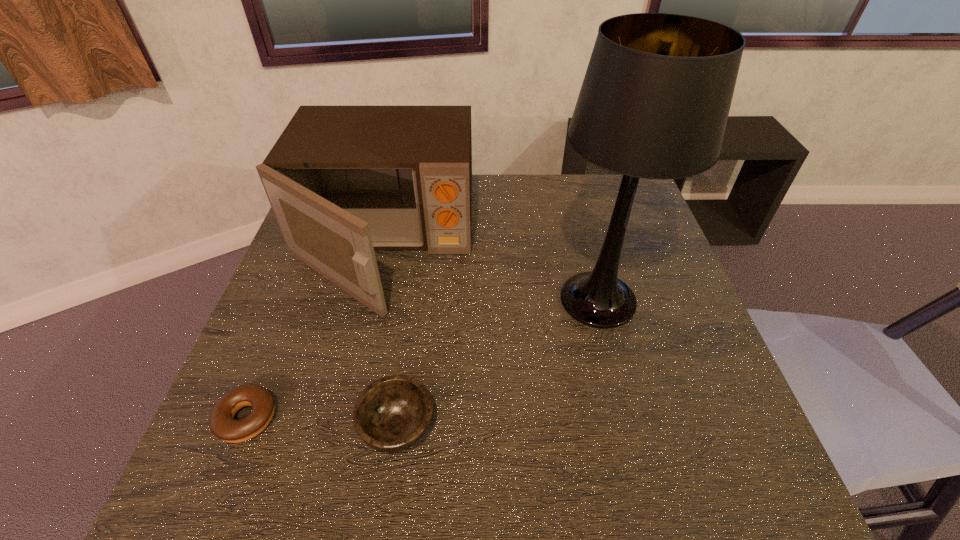
Image resolution: width=960 pixels, height=540 pixels. In order to click on vacant space that's between the table lamp and the second shortest object in this screenshot , I will do `click(497, 363)`.

At what (x,y) coordinates should I click in order to perform the action: click on free spot between the third shortest object and the doughnut. Please return your answer as a coordinate pair (x, y). The height and width of the screenshot is (540, 960). Looking at the image, I should click on (315, 332).

Identify the location of free area in between the table lamp and the doughnut. This screenshot has width=960, height=540. (422, 359).

Where is `free space between the bowl and the table lamp`? This screenshot has width=960, height=540. free space between the bowl and the table lamp is located at coordinates (497, 363).

Identify the location of free area in between the doughnut and the second shortest object. Image resolution: width=960 pixels, height=540 pixels. (323, 422).

The width and height of the screenshot is (960, 540). In order to click on vacant area that lies between the third tallest object and the rightmost object in this screenshot , I will do `click(497, 363)`.

At what (x,y) coordinates should I click in order to perform the action: click on vacant point located between the bowl and the shortest object. Please return your answer as a coordinate pair (x, y). Looking at the image, I should click on (323, 422).

Where is `free point between the bowl and the shortest object`? This screenshot has height=540, width=960. free point between the bowl and the shortest object is located at coordinates (323, 422).

Find the location of `unoccupied area between the table lamp and the shortest object`. unoccupied area between the table lamp and the shortest object is located at coordinates (422, 359).

Identify which object is the second closest to the microwave oven. Please provide its 2D coordinates. Your answer should be formatted as a tuple, i.e. [(x, y)], where the tuple contains the x and y coordinates of a point satisfying the conditions above.

[(654, 103)]